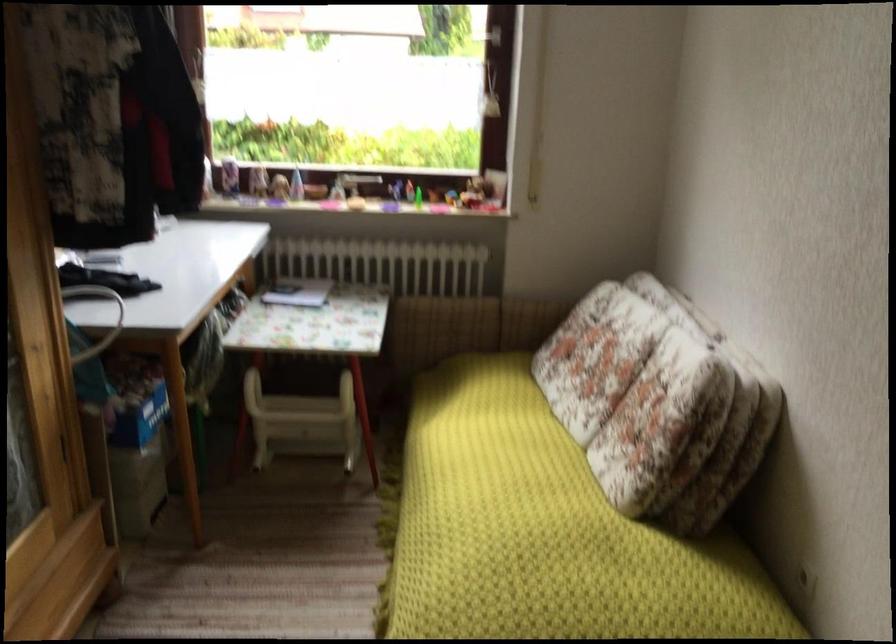
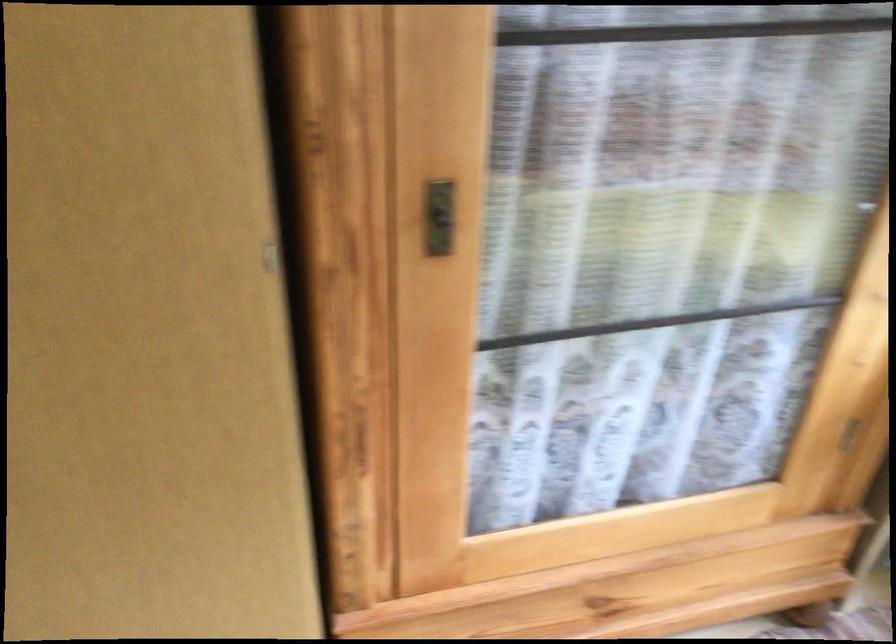
The first image is from the beginning of the video and the second image is from the end. How did the camera likely rotate when shooting the video?

The rotation direction of the camera is left-down.